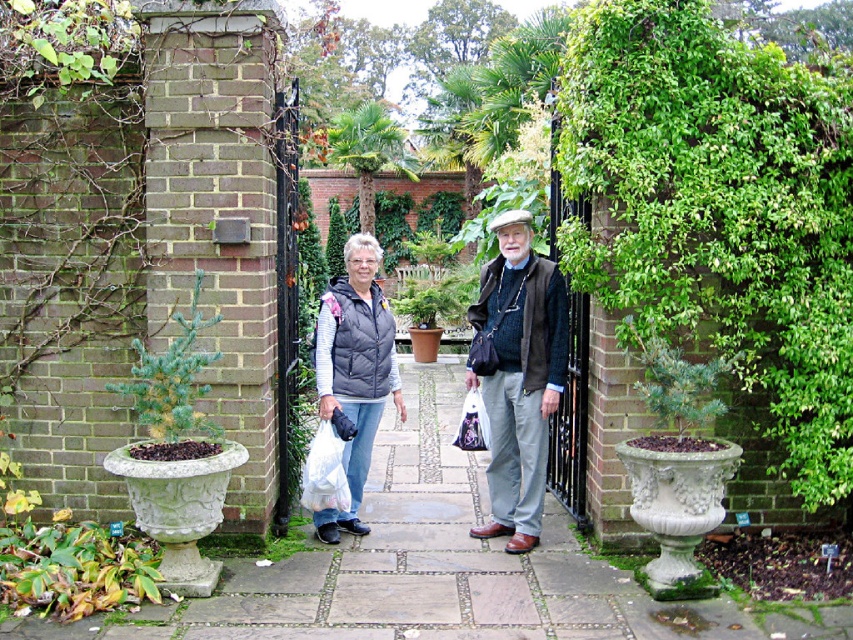
You are a tailor who needs to determine which vest requires more fabric to make between the matte gray vest at center and the matte black vest at center. Which one would need more fabric?

The matte gray vest at center requires more fabric because its width is greater than the matte black vest at center.

Based on the photo, you are standing at point (64, 534) and want to walk to the garden exit located at point (520, 442). Is the exit directly in front of you or behind you?

The exit at point (520, 442) is behind point (64, 534), so it is behind you.